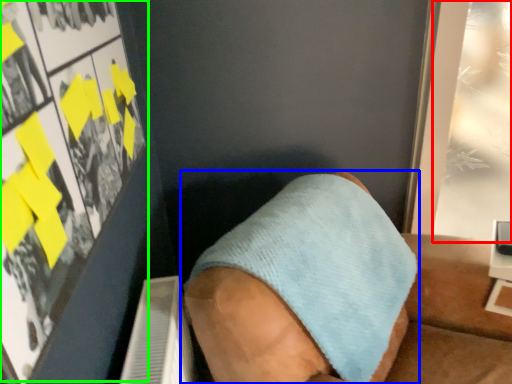
Question: Considering the real-world distances, which object is closest to poster page (highlighted by a red box)? footwear (highlighted by a blue box) or poster page (highlighted by a green box).

Choices:
 (A) footwear
 (B) poster page

Answer: (A)